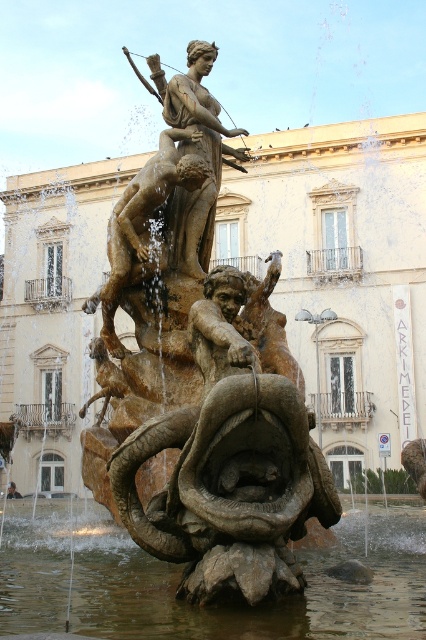
Does translucent stone water at center have a lesser width compared to bronze statue at upper center?

In fact, translucent stone water at center might be wider than bronze statue at upper center.

Which is more to the right, translucent stone water at center or bronze statue at upper center?

From the viewer's perspective, bronze statue at upper center appears more on the right side.

Image resolution: width=426 pixels, height=640 pixels. What do you see at coordinates (256, 605) in the screenshot? I see `translucent stone water at center` at bounding box center [256, 605].

Locate an element on the screen. This screenshot has height=640, width=426. translucent stone water at center is located at coordinates (256, 605).